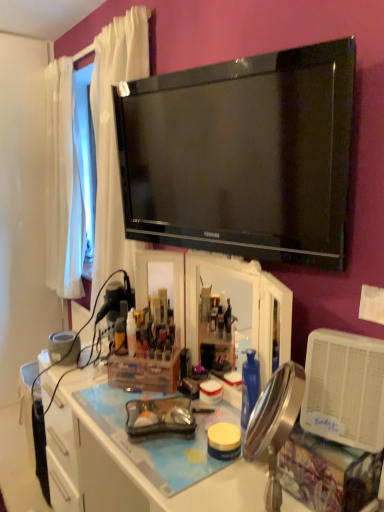
Image resolution: width=384 pixels, height=512 pixels. I want to click on blank space situated above translucent plastic container at center (from a real-world perspective), so click(148, 354).